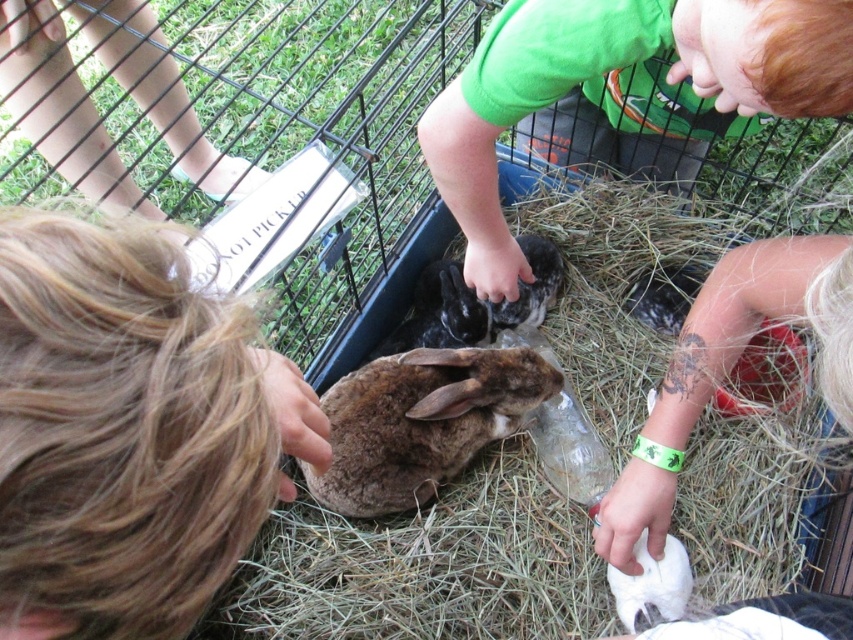
Is green cotton shirt at upper center further to camera compared to brown fuzzy rabbit at center?

That is False.

Can you confirm if green cotton shirt at upper center is bigger than brown fuzzy rabbit at center?

Yes.

Measure the distance between green cotton shirt at upper center and camera.

green cotton shirt at upper center is 22.17 inches away from camera.

Find the location of a particular element. green cotton shirt at upper center is located at coordinates (624, 96).

In the scene shown: Which is below, white soft fur at lower center or soft gray fur rabbit at center?

white soft fur at lower center is lower down.

Describe the element at coordinates (653, 586) in the screenshot. I see `white soft fur at lower center` at that location.

Where is `white soft fur at lower center`? The height and width of the screenshot is (640, 853). white soft fur at lower center is located at coordinates (653, 586).

This screenshot has height=640, width=853. I want to click on white soft fur at lower center, so click(653, 586).

Looking at this image, can you confirm if brown soft hay at center is positioned below green cotton shirt at upper center?

Yes.

Does point (706, 513) come closer to viewer compared to point (827, 44)?

No, it is behind (827, 44).

Is point (454, 636) positioned behind point (521, 80)?

Yes, point (454, 636) is behind point (521, 80).

At what (x,y) coordinates should I click in order to perform the action: click on brown soft hay at center. Please return your answer as a coordinate pair (x, y). Looking at the image, I should click on (424, 566).